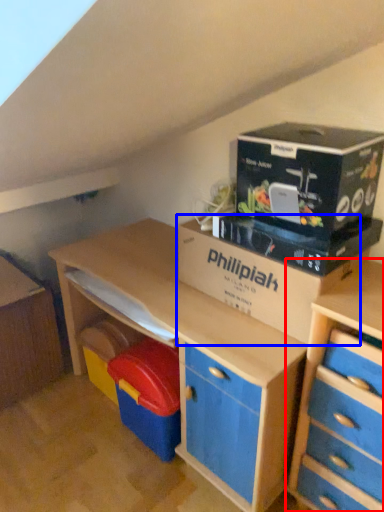
Question: Which point is closer to the camera, chest of drawers (highlighted by a red box) or cardboard box (highlighted by a blue box)?

Choices:
 (A) chest of drawers
 (B) cardboard box

Answer: (A)